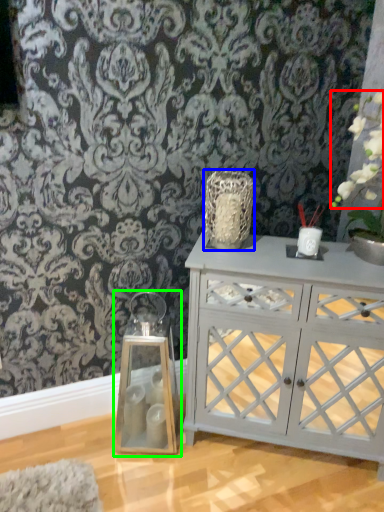
Question: Estimate the real-world distances between objects in this image. Which object is farther from floral arrangement (highlighted by a red box), vase (highlighted by a blue box) or candle holder (highlighted by a green box)?

Choices:
 (A) vase
 (B) candle holder

Answer: (B)